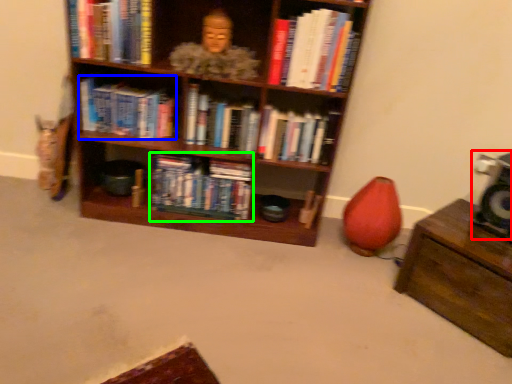
Question: Estimate the real-world distances between objects in this image. Which object is farther from speaker (highlighted by a red box), book (highlighted by a blue box) or book (highlighted by a green box)?

Choices:
 (A) book
 (B) book

Answer: (A)